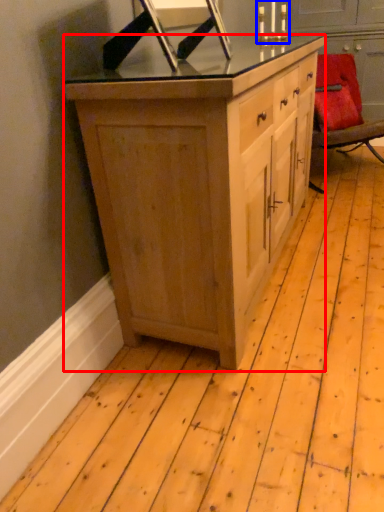
Question: Which of the following is the farthest to the observer, cabinetry (highlighted by a red box) or candle holder (highlighted by a blue box)?

Choices:
 (A) cabinetry
 (B) candle holder

Answer: (B)